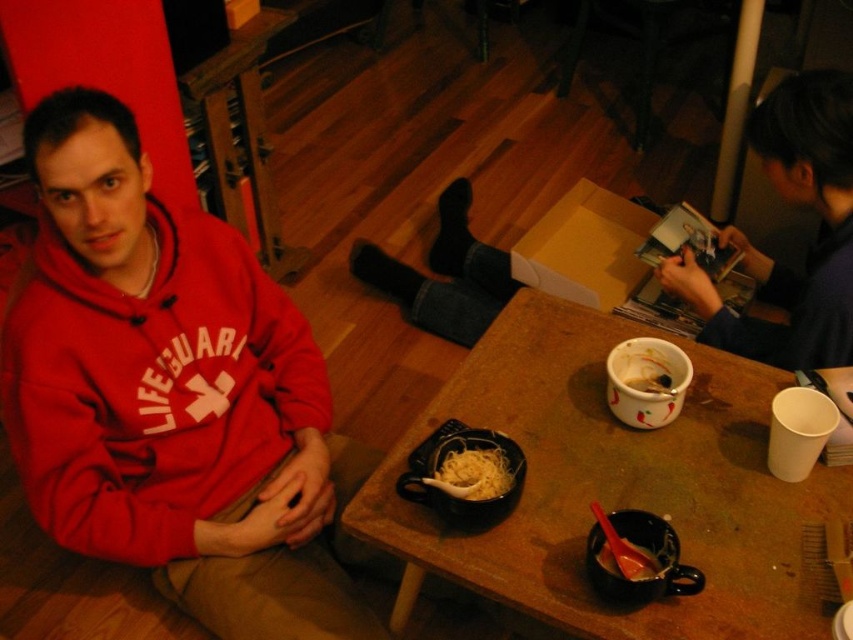
You are a guest at this gathering and want to choose a container to hold your drink. Considering the items on the table, which one is bigger between the matte black mug with spoon at lower center and the yellow noodle at center?

The matte black mug with spoon at lower center has a larger size compared to the yellow noodle at center, so the matte black mug with spoon at lower center is the bigger one.

From the picture: You are organizing a small gathering and need to decide where to place a large centerpiece. Given the wooden table at center and the dark blue fabric at upper right, which surface can accommodate the centerpiece better?

The wooden table at center is bigger than the dark blue fabric at upper right, so the wooden table at center can accommodate the centerpiece better.